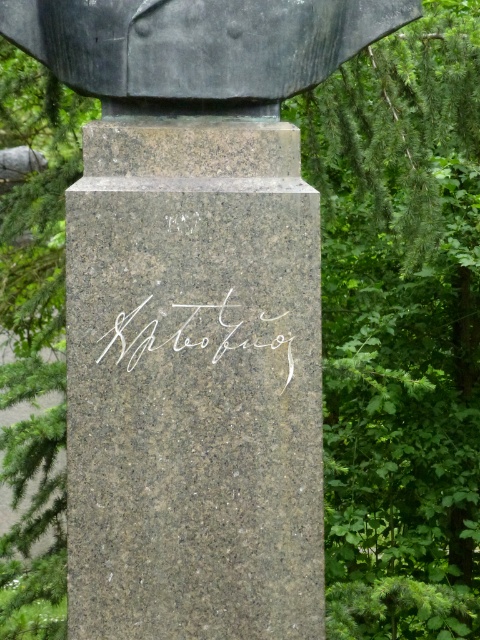
Question: Is polished dark gray bust at upper center to the right of white metallic writing at center from the viewer's perspective?

Choices:
 (A) no
 (B) yes

Answer: (B)

Question: Does polished dark gray bust at upper center appear over white metallic writing at center?

Choices:
 (A) no
 (B) yes

Answer: (B)

Question: Is polished dark gray bust at upper center wider than white metallic writing at center?

Choices:
 (A) no
 (B) yes

Answer: (B)

Question: Which point is closer to the camera taking this photo?

Choices:
 (A) (113, 348)
 (B) (202, 4)

Answer: (B)